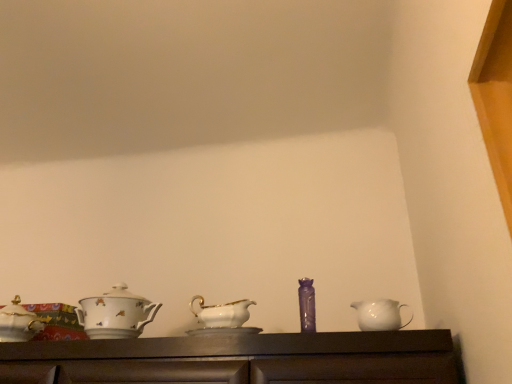
Question: From a real-world perspective, is white glossy jug at right physically located above or below white porcelain teapot at left, which appears as the 2th tableware when viewed from the right?

Choices:
 (A) above
 (B) below

Answer: (B)

Question: Based on their positions, is white glossy jug at right located to the left or right of white porcelain teapot at left, which appears as the 2th tableware when viewed from the right?

Choices:
 (A) left
 (B) right

Answer: (B)

Question: Based on their relative distances, which object is nearer to the white porcelain teapot at left, which appears as the 2th tableware when viewed from the right?

Choices:
 (A) purple glass vase at center, marked as the 1th tableware in a right-to-left arrangement
 (B) white glossy jug at right

Answer: (A)

Question: Based on their relative distances, which object is nearer to the white glossy jug at right?

Choices:
 (A) white porcelain teapot at left, which appears as the 2th tableware when viewed from the right
 (B) purple glass vase at center, which appears as the 2th tableware when viewed from the left

Answer: (B)